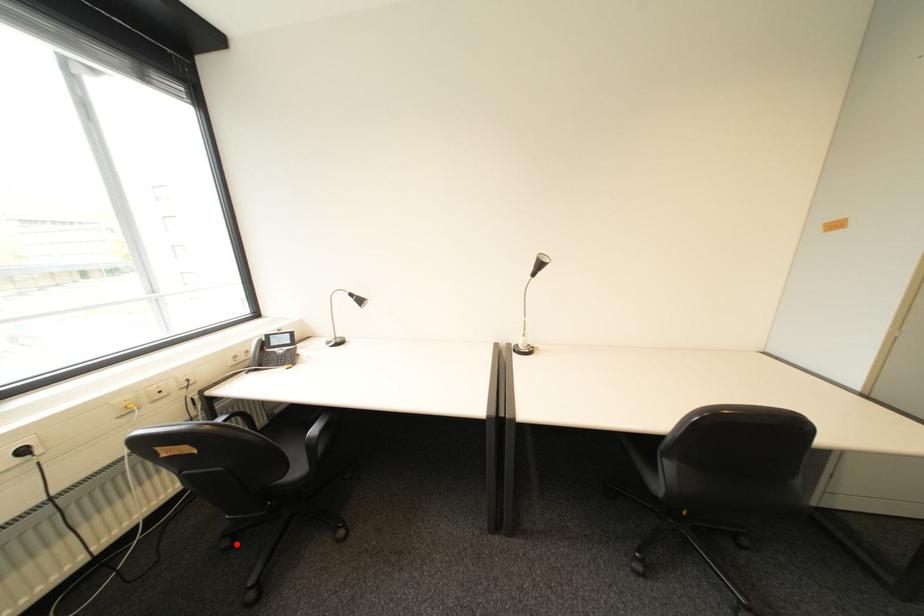
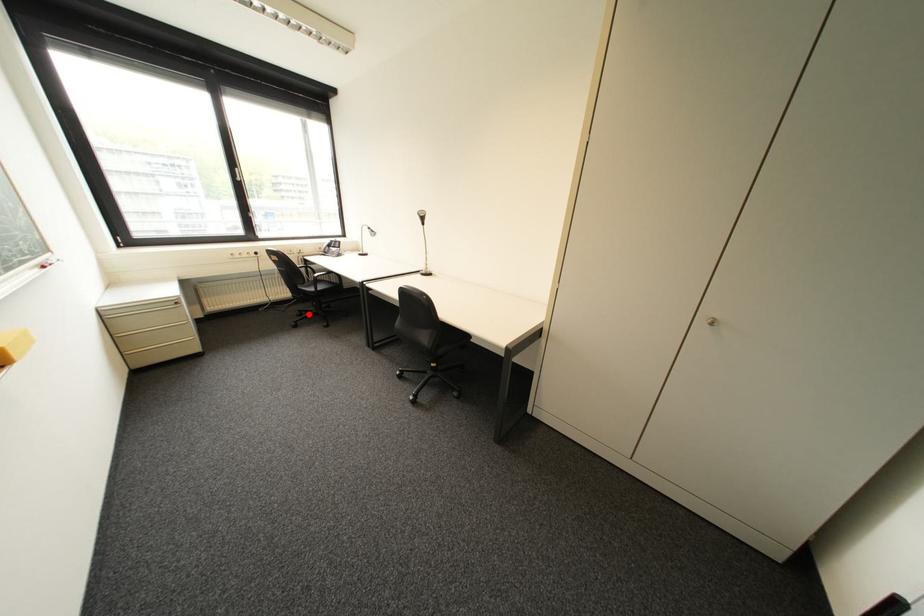
I am providing you with two images of the same scene from different viewpoints. A red point is marked on the first image and another point is marked on the second image. Is the marked point in image1 the same physical position as the marked point in image2?

Yes